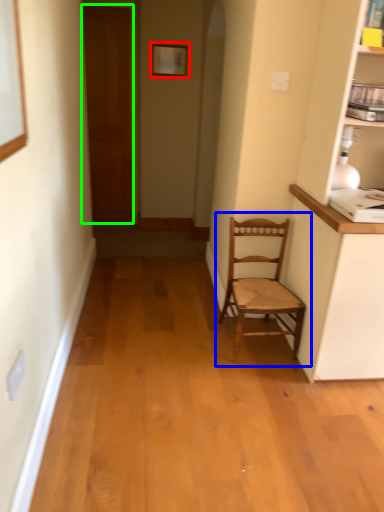
Question: Estimate the real-world distances between objects in this image. Which object is farther from picture frame (highlighted by a red box), chair (highlighted by a blue box) or door (highlighted by a green box)?

Choices:
 (A) chair
 (B) door

Answer: (A)